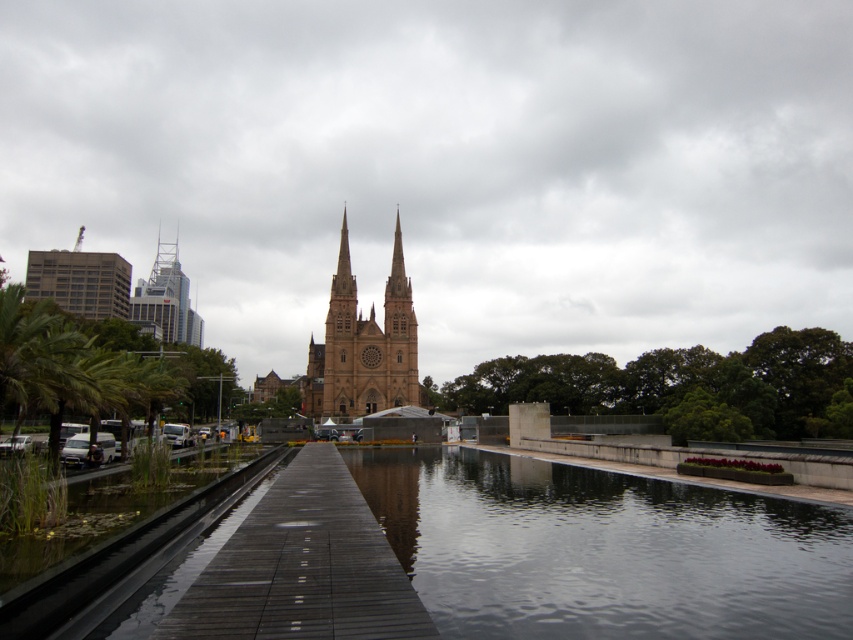
You are a tour guide leading a group to the brown stone tower at center from the dark gray wooden dock at center. The group has a time limit of 10 minutes to reach the tower. Assuming an average walking speed of 1.4 meters per second, will they make it on time?

The distance between the dark gray wooden dock at center and the brown stone tower at center is 38.70 meters. At an average walking speed of 1.4 meters per second, it would take approximately 27.6 seconds to cover this distance. Since 27.6 seconds is less than 10 minutes, the group will arrive well before the time limit.

You are standing at the point marked by the coordinates point (x=602, y=550) in the image. What type of surface are you currently standing on?

The point (x=602, y=550) marks smooth concrete river at center, so you are standing on a smooth concrete river surface.

You are a delivery person needing to place a large crate on the dark gray wooden dock at center or the dark gray wooden train track at lower left. Which location can accommodate the crate if it is wider than the train track?

The dark gray wooden dock at center has a greater width than the dark gray wooden train track at lower left, so the dark gray wooden dock at center can accommodate the crate if it is wider than the train track.